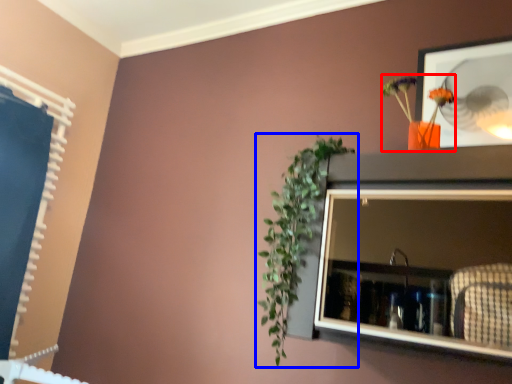
Question: Which point is further to the camera, floral arrangement (highlighted by a red box) or houseplant (highlighted by a blue box)?

Choices:
 (A) floral arrangement
 (B) houseplant

Answer: (A)